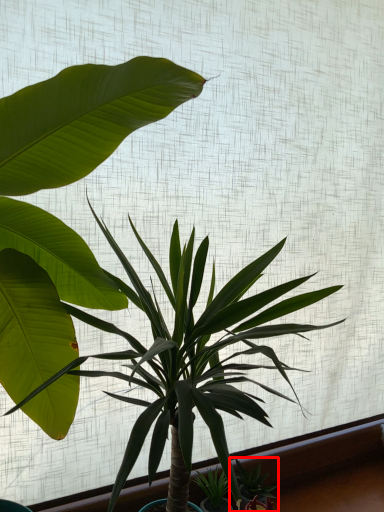
Question: From the image's perspective, what is the correct spatial relationship of houseplant (annotated by the red box) in relation to houseplant?

Choices:
 (A) above
 (B) below

Answer: (B)